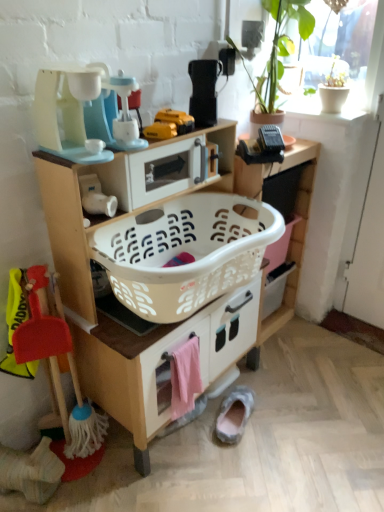
Question: Is point (178, 366) closer or farther from the camera than point (210, 96)?

Choices:
 (A) farther
 (B) closer

Answer: (B)

Question: Is pink fabric towel at lower center inside the boundaries of black plastic toaster at upper center, the 1th appliance when ordered from right to left, or outside?

Choices:
 (A) outside
 (B) inside

Answer: (A)

Question: Estimate the real-world distances between objects in this image. Which object is farther from the red plastic broom at lower left, which appears as the 1th toy when ordered from the bottom?

Choices:
 (A) white plastic microwave at upper center, the second appliance when ordered from left to right
 (B) gray suede slipper at lower center
 (C) pink fabric towel at lower center
 (D) matte plastic toy coffee maker at upper left, the first appliance viewed from the left
 (E) white plastic laundry basket at center

Answer: (B)

Question: Estimate the real-world distances between objects in this image. Which object is farther from the white matte pot at upper right?

Choices:
 (A) white plastic laundry basket at center
 (B) black plastic toaster at upper center, the 1th appliance when ordered from right to left
 (C) gray suede slipper at lower center
 (D) matte plastic toy coffee maker at upper left, the first appliance viewed from the left
 (E) white plastic microwave at upper center, marked as the 2th appliance in a right-to-left arrangement

Answer: (C)